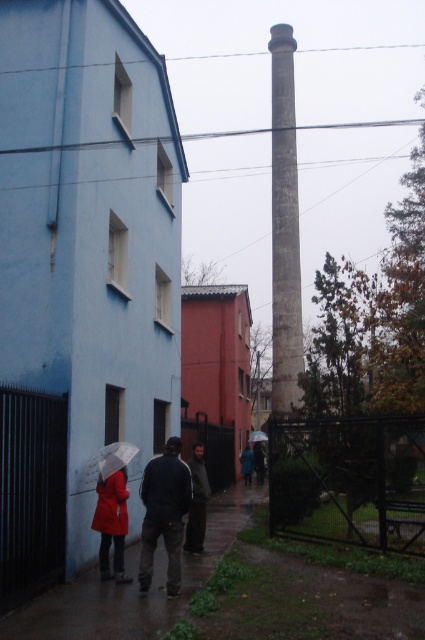
From the picture: You are a delivery person trying to decide which jacket to wear for the rainy day. The matte red jacket at lower left and the blue fabric jacket at center are both available. Based on the scene, which jacket would be more visible to drivers in low visibility conditions?

The matte red jacket at lower left is much taller as blue fabric jacket at center, making it more visible to drivers in low visibility conditions due to its greater height and bright color contrast against the dark surroundings.

You are standing at the origin point of the coordinate system in the image. The matte red jacket at lower left is at point 0.916, 0.313. Which direction should you move to reach it?

The matte red jacket at lower left is located at coordinates 0.916 on the x and 0.313 on the y. Since you are at the origin, you should move towards the lower left direction to reach it.

You are a photographer trying to capture both the matte red jacket at lower left and the transparent plastic umbrella at center in a single shot. Based on their sizes in the image, which object would appear larger in your photo?

The matte red jacket at lower left appears larger in the photo because it is much taller than the transparent plastic umbrella at center.